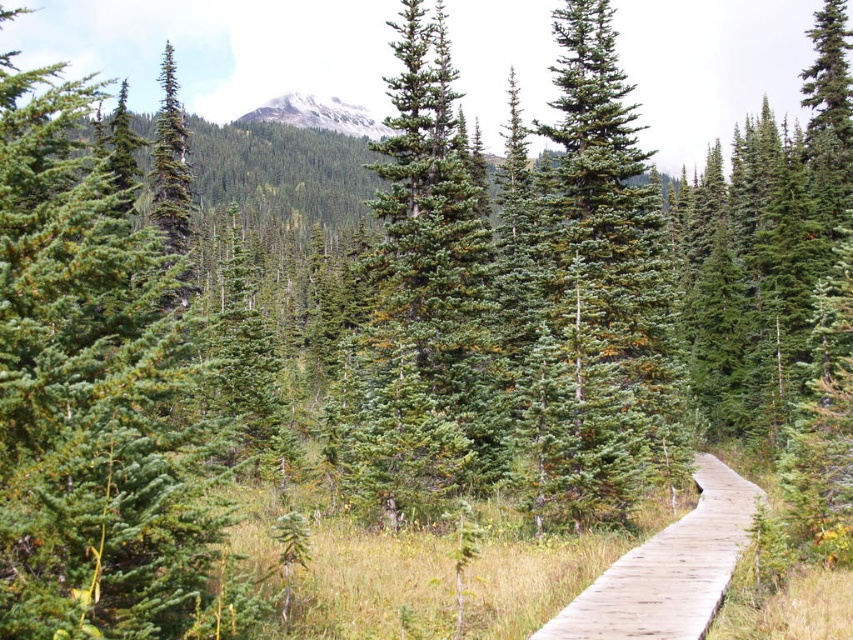
Question: Is green needle-like at left further to the viewer compared to snowy granite mountain at upper center?

Choices:
 (A) no
 (B) yes

Answer: (A)

Question: Which of the following is the closest to the observer?

Choices:
 (A) snowy granite mountain at upper center
 (B) green matte tree at center
 (C) wooden boardwalk at center-right

Answer: (C)

Question: Can you confirm if green needle-like at left is smaller than wooden boardwalk at center-right?

Choices:
 (A) yes
 (B) no

Answer: (B)

Question: Among these objects, which one is farthest from the camera?

Choices:
 (A) green needle-like at center
 (B) green matte tree at center

Answer: (B)

Question: Does green matte tree at center have a larger size compared to snowy granite mountain at upper center?

Choices:
 (A) yes
 (B) no

Answer: (B)

Question: Among these points, which one is nearest to the camera?

Choices:
 (A) (631, 113)
 (B) (312, 124)
 (C) (381, 310)

Answer: (C)